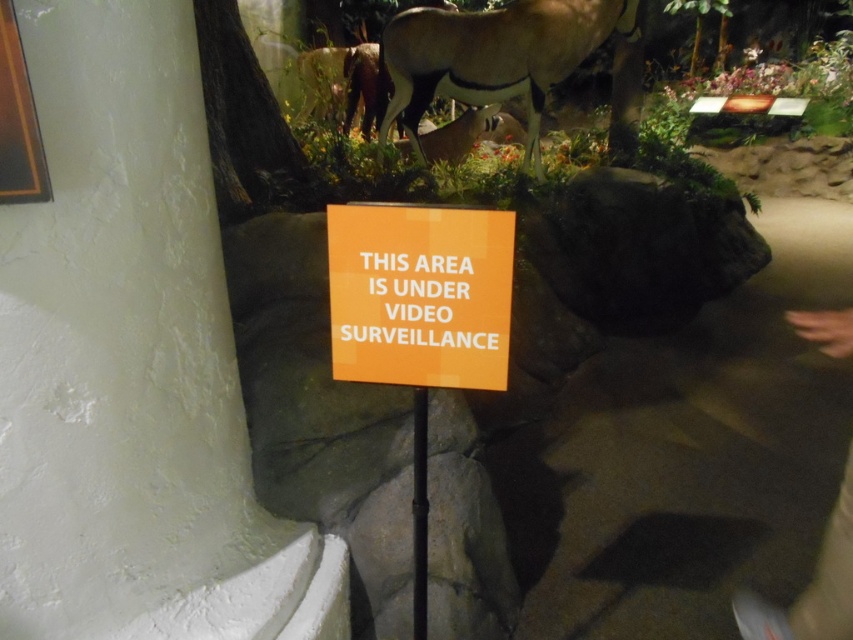
You are a visitor at the museum and want to take a photo of the orange matte sign at center without any obstruction. The dark gray pants at lower right are in the way. Can you move to the left to get a clear shot?

The orange matte sign at center is smaller than the dark gray pants at lower right. Moving to the left might help avoid the pants obstruction, but since the sign is smaller, you might need to adjust your angle or position further to ensure the entire sign is visible without the pants blocking it.

You are a security guard in the museum. You notice the orange matte sign at center and the dark gray pants at lower right. According to the surveillance camera, which object is directly above the other?

The orange matte sign at center is positioned over dark gray pants at lower right, so the orange matte sign at center is directly above the dark gray pants at lower right.